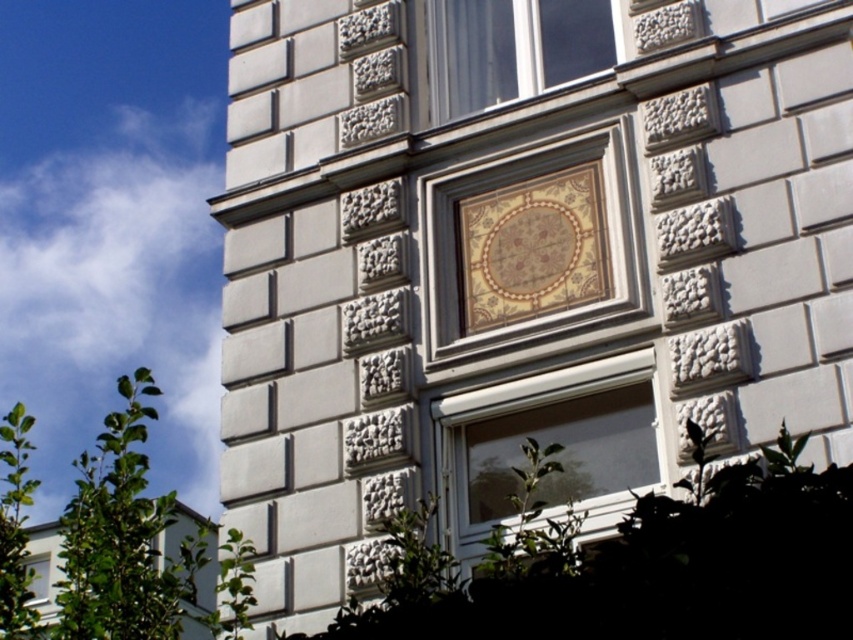
Is gold mosaic tile at center smaller than clear glass window at lower left?

Yes.

Does point (567, 157) come closer to viewer compared to point (27, 564)?

Yes, point (567, 157) is closer to viewer.

I want to click on gold mosaic tile at center, so click(532, 244).

Who is shorter, clear glass window at upper center or clear glass window at lower left?

With less height is clear glass window at upper center.

This screenshot has height=640, width=853. Identify the location of clear glass window at upper center. (506, 51).

Measure the distance between point (512, 22) and camera.

The distance of point (512, 22) from camera is 39.65 meters.

Image resolution: width=853 pixels, height=640 pixels. In order to click on clear glass window at upper center in this screenshot , I will do `click(506, 51)`.

Looking at this image, can you confirm if white plastic window at center is wider than clear glass window at upper center?

Correct, the width of white plastic window at center exceeds that of clear glass window at upper center.

Which is in front, point (465, 528) or point (582, 58)?

Point (465, 528) is in front.

What do you see at coordinates (547, 444) in the screenshot?
I see `white plastic window at center` at bounding box center [547, 444].

Where is `white plastic window at center`? This screenshot has width=853, height=640. white plastic window at center is located at coordinates point(547,444).